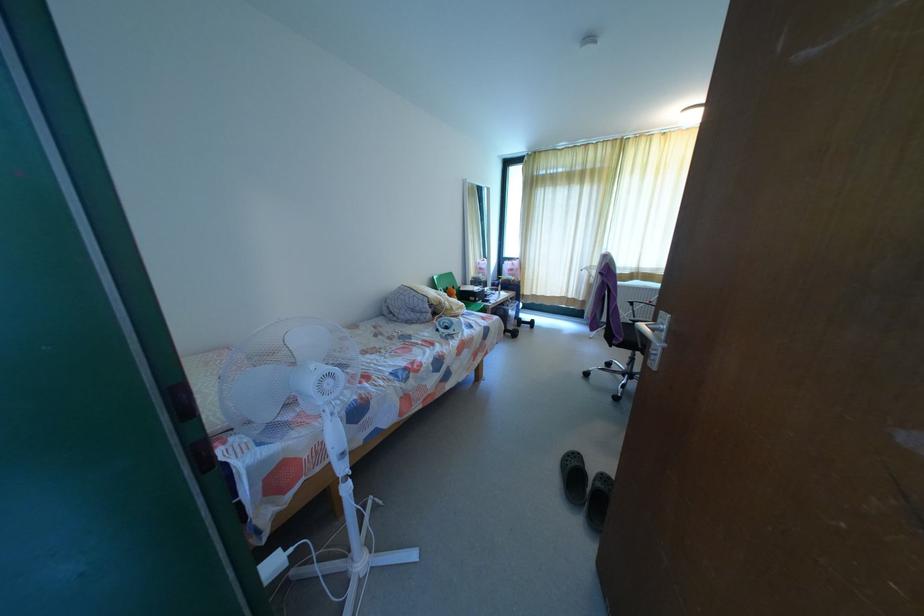
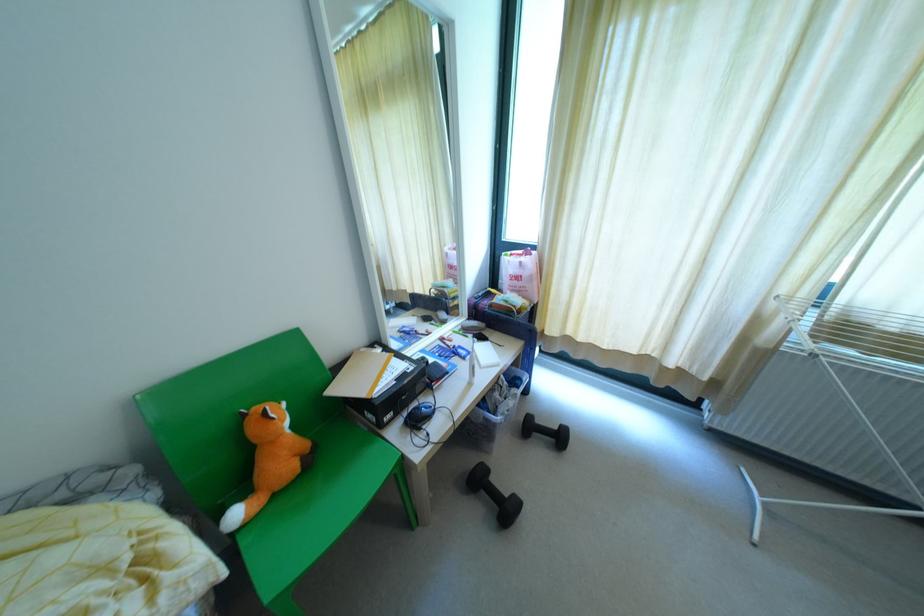
Question: In a continuous first-person perspective shot, in which direction is the camera moving?

Choices:
 (A) Left
 (B) Right
 (C) Forward
 (D) Backward

Answer: (C)